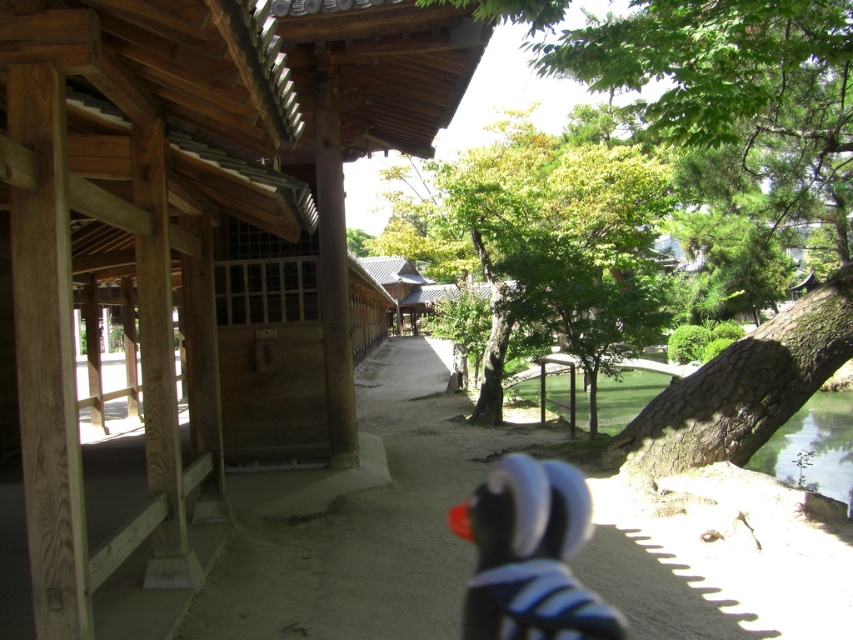
You are visiting a traditional Japanese garden and notice two central elements, the wooden hut at center and the green leafy tree at center. Which one appears larger in size?

The green leafy tree at center is larger than the wooden hut at center.

You are visiting a traditional Japanese garden and want to take a photo of the wooden hut at center and the green leafy tree at center. If you stand where the image was taken, which object will appear closer to you in the photo?

The wooden hut at center is in front of the green leafy tree at center, so it will appear closer to you in the photo.